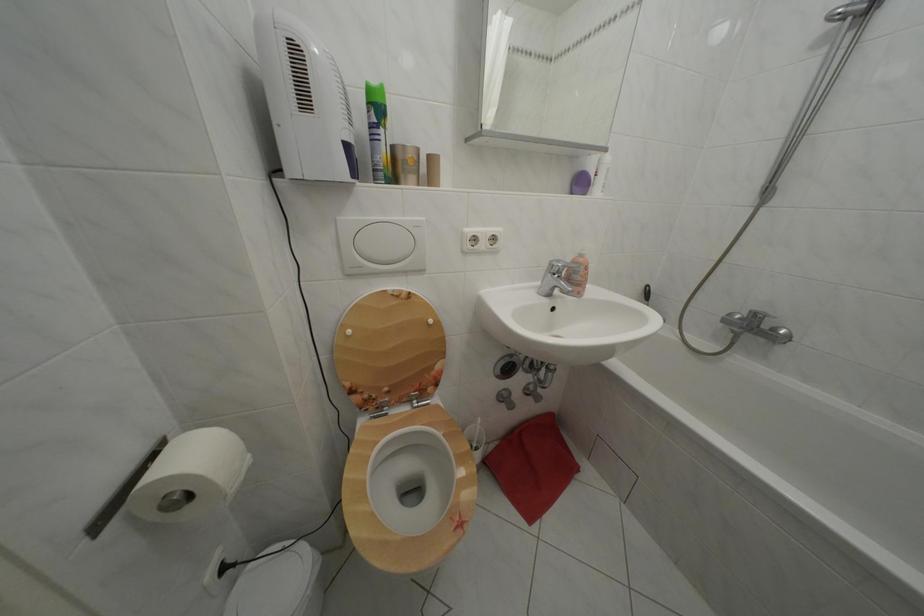
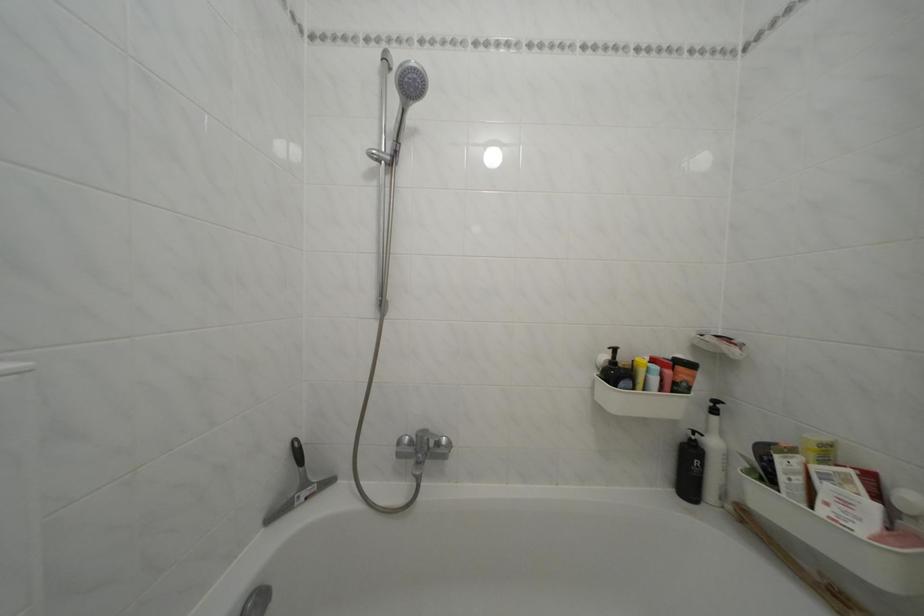
Question: The images are taken continuously from a first-person perspective. In which direction is your viewpoint rotating?

Choices:
 (A) Left
 (B) Right
 (C) Up
 (D) Down

Answer: (B)